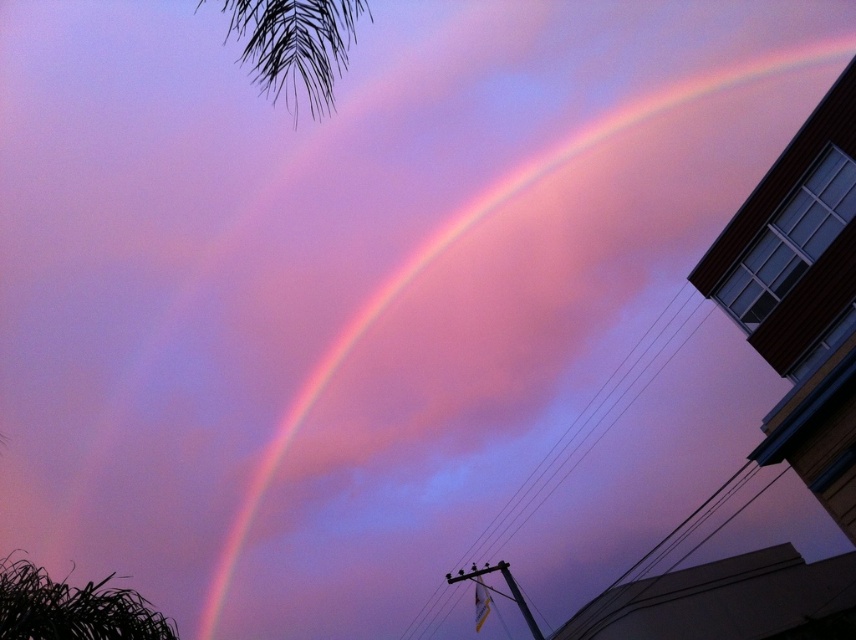
Question: Which object appears closest to the camera in this image?

Choices:
 (A) black leafy palm at upper left
 (B) rainbow at upper center

Answer: (A)

Question: Does rainbow at upper center have a larger size compared to black leafy palm at upper left?

Choices:
 (A) no
 (B) yes

Answer: (B)

Question: Can you confirm if rainbow at upper center is positioned below black leafy palm at upper left?

Choices:
 (A) yes
 (B) no

Answer: (A)

Question: Is rainbow at upper center positioned in front of black leafy palm at upper left?

Choices:
 (A) no
 (B) yes

Answer: (A)

Question: Which point is closer to the camera?

Choices:
 (A) black leafy palm at upper left
 (B) rainbow at upper center

Answer: (A)